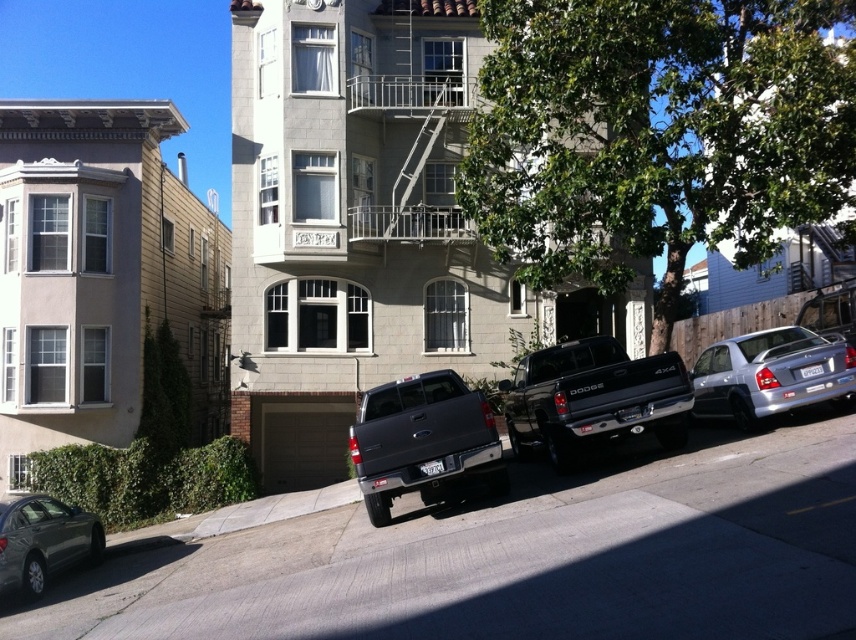
Question: Which point is closer to the camera taking this photo?

Choices:
 (A) (569, 420)
 (B) (82, 529)
 (C) (773, 362)

Answer: (A)

Question: Is black matte truck at center smaller than gray matte truck at center?

Choices:
 (A) yes
 (B) no

Answer: (B)

Question: Which object is closer to the camera taking this photo?

Choices:
 (A) metallic gray sedan at lower left
 (B) black matte truck at center
 (C) gray matte truck at center

Answer: (A)

Question: Is black matte truck at center closer to camera compared to silver metallic sedan at right?

Choices:
 (A) yes
 (B) no

Answer: (A)

Question: Which point is farther from the camera taking this photo?

Choices:
 (A) 589,381
 (B) 774,352
 (C) 9,538
 (D) 424,476

Answer: (B)

Question: From the image, what is the correct spatial relationship of gray matte truck at center in relation to metallic gray sedan at lower left?

Choices:
 (A) above
 (B) below

Answer: (A)